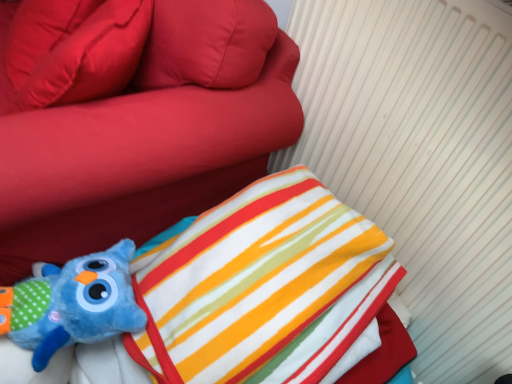
Question: Is soft plush toy at lower left thinner than blue plush toy at lower left?

Choices:
 (A) yes
 (B) no

Answer: (B)

Question: Considering the relative positions of soft plush toy at lower left and blue plush toy at lower left in the image provided, is soft plush toy at lower left to the right of blue plush toy at lower left from the viewer's perspective?

Choices:
 (A) yes
 (B) no

Answer: (B)

Question: From the image's perspective, is soft plush toy at lower left over blue plush toy at lower left?

Choices:
 (A) yes
 (B) no

Answer: (A)

Question: From a real-world perspective, is soft plush toy at lower left beneath blue plush toy at lower left?

Choices:
 (A) yes
 (B) no

Answer: (A)

Question: Is blue plush toy at lower left at the back of soft plush toy at lower left?

Choices:
 (A) yes
 (B) no

Answer: (B)

Question: In the image, is matte red pillow at upper left on the left side or the right side of blue plush toy at lower left?

Choices:
 (A) left
 (B) right

Answer: (A)

Question: Is matte red pillow at upper left taller or shorter than blue plush toy at lower left?

Choices:
 (A) tall
 (B) short

Answer: (A)

Question: From the image's perspective, is matte red pillow at upper left above or below blue plush toy at lower left?

Choices:
 (A) above
 (B) below

Answer: (A)

Question: From a real-world perspective, is matte red pillow at upper left positioned above or below blue plush toy at lower left?

Choices:
 (A) below
 (B) above

Answer: (B)

Question: From a real-world perspective, relative to blue plush toy at lower left, is soft plush toy at lower left vertically above or below?

Choices:
 (A) below
 (B) above

Answer: (A)

Question: Does point (288, 107) appear closer or farther from the camera than point (86, 266)?

Choices:
 (A) farther
 (B) closer

Answer: (A)

Question: Based on their sizes in the image, would you say soft plush toy at lower left is bigger or smaller than blue plush toy at lower left?

Choices:
 (A) big
 (B) small

Answer: (A)

Question: Considering the positions of soft plush toy at lower left and blue plush toy at lower left in the image, is soft plush toy at lower left taller or shorter than blue plush toy at lower left?

Choices:
 (A) short
 (B) tall

Answer: (B)

Question: In the image, is soft plush toy at lower left on the left side or the right side of matte red pillow at upper left?

Choices:
 (A) left
 (B) right

Answer: (A)

Question: Do you think soft plush toy at lower left is within matte red pillow at upper left, or outside of it?

Choices:
 (A) outside
 (B) inside

Answer: (A)